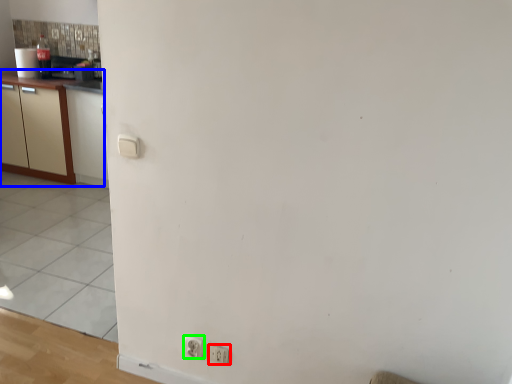
Question: Considering the real-world distances, which object is farthest from electric outlet (highlighted by a red box)? cabinetry (highlighted by a blue box) or electric outlet (highlighted by a green box)?

Choices:
 (A) cabinetry
 (B) electric outlet

Answer: (A)